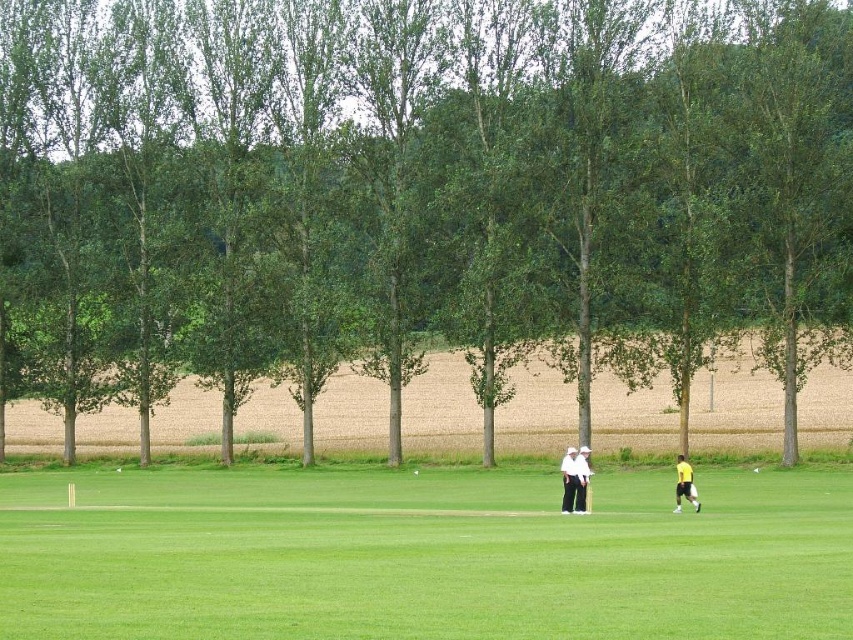
Question: Which point is closer to the camera?

Choices:
 (A) white cotton shirt and trousers at center
 (B) yellow fabric person at lower right

Answer: (A)

Question: Can you confirm if green grass at center is wider than yellow fabric person at lower right?

Choices:
 (A) no
 (B) yes

Answer: (B)

Question: Which is farther from the yellow fabric person at lower right?

Choices:
 (A) green leafy tree at center
 (B) green grass at center
 (C) white cotton shirt and trousers at center

Answer: (A)

Question: Is green leafy tree at center positioned in front of green grass at center?

Choices:
 (A) yes
 (B) no

Answer: (B)

Question: Is green leafy tree at center wider than yellow fabric person at lower right?

Choices:
 (A) yes
 (B) no

Answer: (A)

Question: Which object appears closest to the camera in this image?

Choices:
 (A) green grass at center
 (B) yellow fabric person at lower right

Answer: (A)